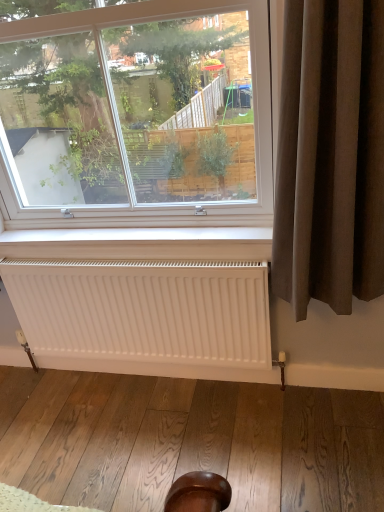
I want to click on clear glass window at upper center, so (x=110, y=85).

You are a GUI agent. You are given a task and a screenshot of the screen. Output one action in this format:
    pyautogui.click(x=<x>, y=<y>)
    Task: Click on the clear glass window at upper center
    
    Given the screenshot: What is the action you would take?
    pyautogui.click(x=110, y=85)

Does clear glass window at upper center appear on the right side of white matte radiator at lower center?

In fact, clear glass window at upper center is to the left of white matte radiator at lower center.

From a real-world perspective, does clear glass window at upper center sit lower than white matte radiator at lower center?

Incorrect, from a real-world perspective, clear glass window at upper center is higher than white matte radiator at lower center.

Measure the distance from clear glass window at upper center to white matte radiator at lower center.

clear glass window at upper center and white matte radiator at lower center are 16.34 inches apart from each other.

Is clear glass window at upper center facing away from white matte radiator at lower center?

clear glass window at upper center is not turned away from white matte radiator at lower center.

The image size is (384, 512). In order to click on radiator behind the brown fabric curtain at right in this screenshot , I will do `click(146, 316)`.

Between brown fabric curtain at right and white matte radiator at lower center, which one appears on the left side from the viewer's perspective?

From the viewer's perspective, white matte radiator at lower center appears more on the left side.

Is brown fabric curtain at right positioned with its back to white matte radiator at lower center?

No, brown fabric curtain at right is not facing the opposite direction of white matte radiator at lower center.

Which object is wider, brown fabric curtain at right or white matte radiator at lower center?

With larger width is brown fabric curtain at right.

What's the angular difference between brown fabric curtain at right and clear glass window at upper center's facing directions?

0.00105 degrees.

Is brown fabric curtain at right directly adjacent to clear glass window at upper center?

No, brown fabric curtain at right is not next to clear glass window at upper center.

Is brown fabric curtain at right at the left side of clear glass window at upper center?

No, brown fabric curtain at right is not to the left of clear glass window at upper center.

You are a GUI agent. You are given a task and a screenshot of the screen. Output one action in this format:
    pyautogui.click(x=<x>, y=<y>)
    Task: Click on the window that is above the brown fabric curtain at right (from the image's perspective)
    The width and height of the screenshot is (384, 512).
    Given the screenshot: What is the action you would take?
    pyautogui.click(x=110, y=85)

Which of these two, white matte radiator at lower center or clear glass window at upper center, is thinner?

Thinner between the two is white matte radiator at lower center.

In the scene shown: Based on their positions, is white matte radiator at lower center located to the left or right of clear glass window at upper center?

white matte radiator at lower center is positioned on clear glass window at upper center's right side.

Based on the photo, does white matte radiator at lower center have a larger size compared to clear glass window at upper center?

Incorrect, white matte radiator at lower center is not larger than clear glass window at upper center.

Is white matte radiator at lower center not near clear glass window at upper center?

They are positioned close to each other.

Is white matte radiator at lower center outside of brown fabric curtain at right?

Yes, white matte radiator at lower center is located beyond the bounds of brown fabric curtain at right.

Is white matte radiator at lower center far from brown fabric curtain at right?

No, white matte radiator at lower center is in close proximity to brown fabric curtain at right.

Is white matte radiator at lower center at the left side of brown fabric curtain at right?

Yes.

Is white matte radiator at lower center thinner than brown fabric curtain at right?

Yes.

From a real-world perspective, is clear glass window at upper center under brown fabric curtain at right?

Incorrect, from a real-world perspective, clear glass window at upper center is higher than brown fabric curtain at right.

Is clear glass window at upper center positioned with its back to brown fabric curtain at right?

No, brown fabric curtain at right is not at the back of clear glass window at upper center.

Is clear glass window at upper center to the left of brown fabric curtain at right from the viewer's perspective?

Correct, you'll find clear glass window at upper center to the left of brown fabric curtain at right.

Can we say clear glass window at upper center lies outside brown fabric curtain at right?

clear glass window at upper center lies outside brown fabric curtain at right's area.

In the image, there is a clear glass window at upper center. Where is `radiator below it (from the image's perspective)`? radiator below it (from the image's perspective) is located at coordinates (146, 316).

You are a GUI agent. You are given a task and a screenshot of the screen. Output one action in this format:
    pyautogui.click(x=<x>, y=<y>)
    Task: Click on the curtain lying above the white matte radiator at lower center (from the image's perspective)
    
    Given the screenshot: What is the action you would take?
    pyautogui.click(x=330, y=155)

Considering their positions, is brown fabric curtain at right positioned further to white matte radiator at lower center than clear glass window at upper center?

Based on the image, brown fabric curtain at right appears to be further to white matte radiator at lower center.

Based on the photo, estimate the real-world distances between objects in this image. Which object is further from white matte radiator at lower center, clear glass window at upper center or brown fabric curtain at right?

Among the two, brown fabric curtain at right is located further to white matte radiator at lower center.

Looking at this image, from the image, which object appears to be nearer to brown fabric curtain at right, white matte radiator at lower center or clear glass window at upper center?

Based on the image, clear glass window at upper center appears to be nearer to brown fabric curtain at right.

From the image, which object appears to be farther from clear glass window at upper center, white matte radiator at lower center or brown fabric curtain at right?

Among the two, white matte radiator at lower center is located further to clear glass window at upper center.

Considering their positions, is brown fabric curtain at right positioned further to clear glass window at upper center than white matte radiator at lower center?

The object further to clear glass window at upper center is white matte radiator at lower center.

Estimate the real-world distances between objects in this image. Which object is further from brown fabric curtain at right, clear glass window at upper center or white matte radiator at lower center?

The object further to brown fabric curtain at right is white matte radiator at lower center.

You are a GUI agent. You are given a task and a screenshot of the screen. Output one action in this format:
    pyautogui.click(x=<x>, y=<y>)
    Task: Click on the radiator between clear glass window at upper center and brown fabric curtain at right from left to right
    
    Given the screenshot: What is the action you would take?
    pyautogui.click(x=146, y=316)